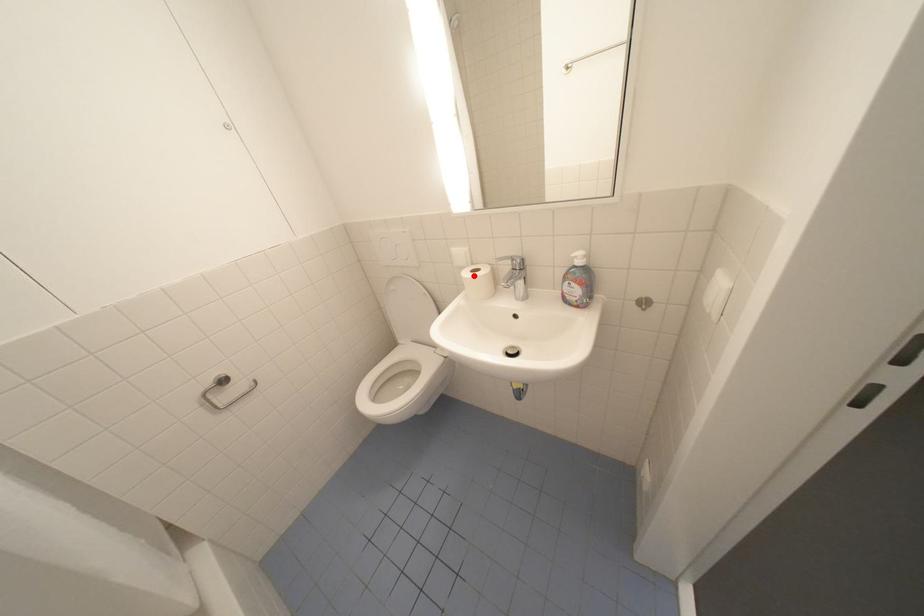
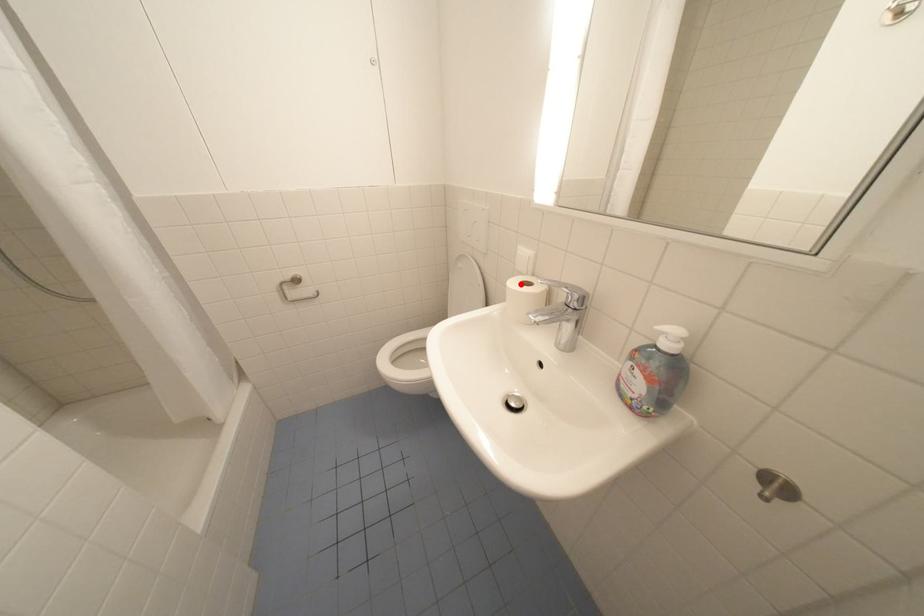
I am providing you with two images of the same scene from different viewpoints. A red point is marked on the first image and another point is marked on the second image. Does the point marked in image1 correspond to the same location as the one in image2?

Yes